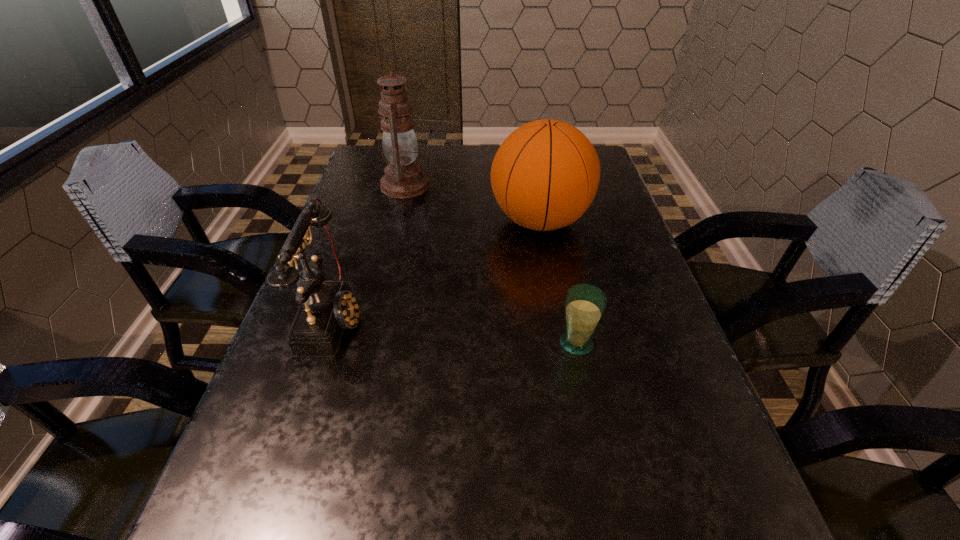
The height and width of the screenshot is (540, 960). What are the coordinates of `the tallest object` in the screenshot? It's located at (404, 178).

Where is `basketball`? basketball is located at coordinates (545, 175).

Locate an element on the screen. telephone is located at coordinates (327, 308).

The height and width of the screenshot is (540, 960). I want to click on glass, so click(584, 305).

Locate an element on the screen. Image resolution: width=960 pixels, height=540 pixels. free location located 0.140m on the right of the oil lamp is located at coordinates coord(479,186).

Locate an element on the screen. This screenshot has height=540, width=960. free space located 0.090m on the front of the basketball is located at coordinates (550, 278).

Locate an element on the screen. vacant space located 0.050m on the dial of the telephone is located at coordinates (386, 318).

The height and width of the screenshot is (540, 960). Identify the location of free region located 0.190m on the left of the shortest object. (458, 343).

Identify the location of object at the far edge. (404, 178).

The image size is (960, 540). Identify the location of oil lamp present at the left edge. (404, 178).